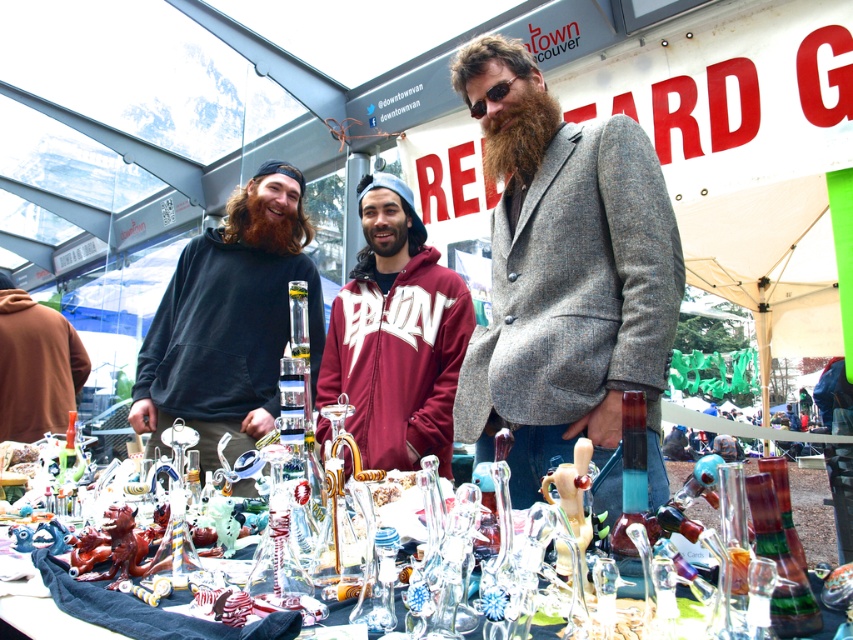
Is point (4, 298) less distant than point (364, 218)?

No, it is not.

Between brown hoodie at left and brown fuzzy beard at center, which one is positioned higher?

Positioned higher is brown fuzzy beard at center.

The image size is (853, 640). What do you see at coordinates (35, 365) in the screenshot?
I see `brown hoodie at left` at bounding box center [35, 365].

The image size is (853, 640). Identify the location of brown hoodie at left. (35, 365).

Who is more distant from viewer, (445, 420) or (514, 118)?

The point (445, 420) is more distant.

This screenshot has height=640, width=853. What do you see at coordinates (396, 340) in the screenshot?
I see `maroon fleece at center` at bounding box center [396, 340].

The height and width of the screenshot is (640, 853). I want to click on maroon fleece at center, so click(x=396, y=340).

How much distance is there between gray wool blazer at center and dark brown textured beard at center?

The distance of gray wool blazer at center from dark brown textured beard at center is 20.21 centimeters.

Does gray wool blazer at center have a larger size compared to dark brown textured beard at center?

Correct, gray wool blazer at center is larger in size than dark brown textured beard at center.

Between point (570, 458) and point (524, 145), which one is positioned behind?

Point (524, 145)

This screenshot has height=640, width=853. In order to click on gray wool blazer at center in this screenshot , I will do `click(566, 275)`.